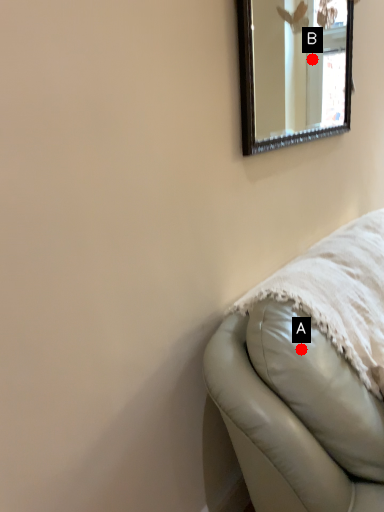
Question: Two points are circled on the image, labeled by A and B beside each circle. Which point is closer to the camera?

Choices:
 (A) A is closer
 (B) B is closer

Answer: (A)